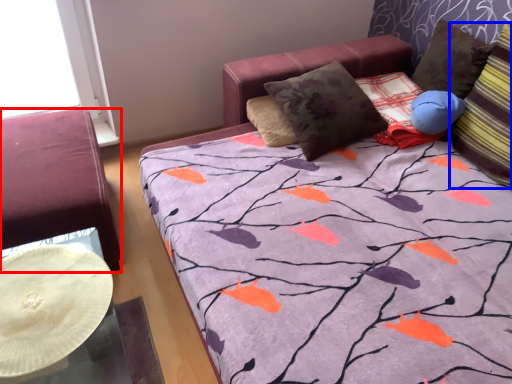
Question: Which object is closer to the camera taking this photo, furniture (highlighted by a red box) or pillow (highlighted by a blue box)?

Choices:
 (A) furniture
 (B) pillow

Answer: (B)